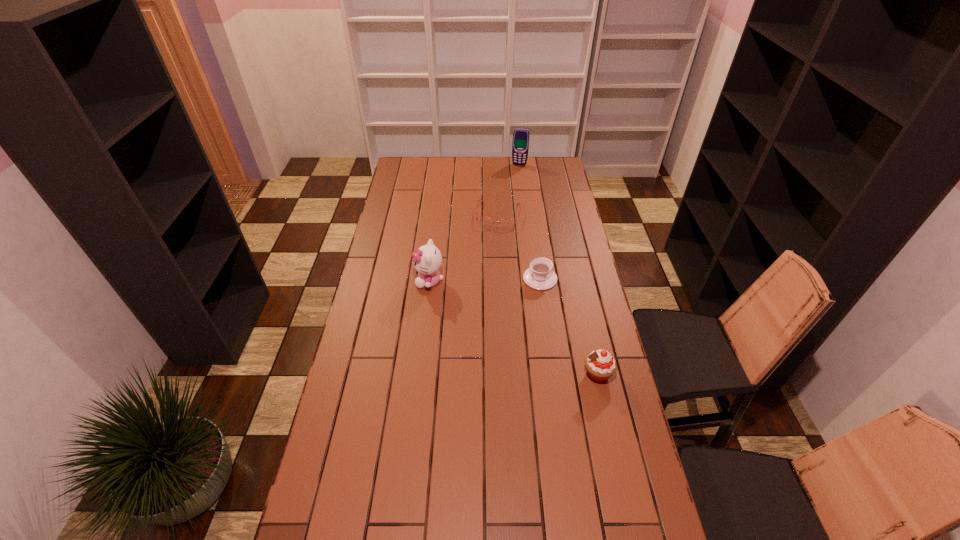
Find the location of a particular element. vacant space located 0.070m on the front-facing side of the leftmost object is located at coordinates (397, 281).

Image resolution: width=960 pixels, height=540 pixels. What are the coordinates of `free space located on the back of the cupcake` in the screenshot? It's located at (581, 303).

Where is `free location located 0.220m on the lenses of the shortest object`? This screenshot has height=540, width=960. free location located 0.220m on the lenses of the shortest object is located at coordinates (491, 259).

Where is `vacant space located 0.150m on the lenses of the shortest object`? The width and height of the screenshot is (960, 540). vacant space located 0.150m on the lenses of the shortest object is located at coordinates [x=492, y=248].

The height and width of the screenshot is (540, 960). I want to click on vacant space located on the lenses of the shortest object, so click(x=493, y=241).

At what (x,y) coordinates should I click in order to perform the action: click on vacant space located 0.350m on the handle side of the teacup. Please return your answer as a coordinate pair (x, y). The height and width of the screenshot is (540, 960). Looking at the image, I should click on (464, 335).

Where is `vacant space located on the handle side of the teacup`? The width and height of the screenshot is (960, 540). vacant space located on the handle side of the teacup is located at coordinates (488, 318).

Locate an element on the screen. vacant space located 0.290m on the handle side of the teacup is located at coordinates (476, 326).

The width and height of the screenshot is (960, 540). I want to click on vacant space situated on the front-facing side of the cellular telephone, so click(513, 194).

The image size is (960, 540). Find the location of `free space located on the front-facing side of the cellular telephone`. free space located on the front-facing side of the cellular telephone is located at coordinates (515, 187).